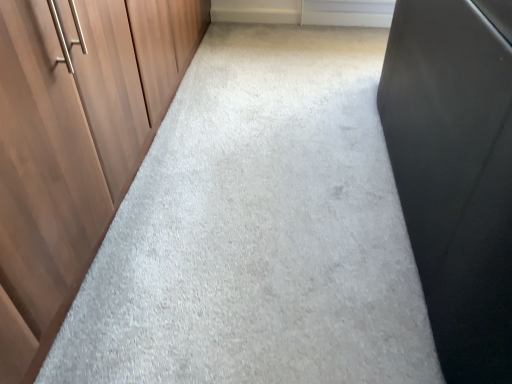
The height and width of the screenshot is (384, 512). Describe the element at coordinates (74, 144) in the screenshot. I see `wooden at left` at that location.

Locate an element on the screen. This screenshot has width=512, height=384. wooden at left is located at coordinates (74, 144).

Locate an element on the screen. The height and width of the screenshot is (384, 512). white matte window at upper center is located at coordinates (347, 12).

What do you see at coordinates (347, 12) in the screenshot? I see `white matte window at upper center` at bounding box center [347, 12].

This screenshot has height=384, width=512. Find the location of `wooden at left`. wooden at left is located at coordinates (74, 144).

Considering the relative positions of wooden at left and white matte window at upper center in the image provided, is wooden at left to the left or to the right of white matte window at upper center?

Based on their positions, wooden at left is located to the left of white matte window at upper center.

Is the position of wooden at left more distant than that of white matte window at upper center?

No, the depth of wooden at left is less than that of white matte window at upper center.

Which is nearer, [47,236] or [367,26]?

Point [47,236] is positioned closer to the camera compared to point [367,26].

From the image's perspective, which one is positioned higher, wooden at left or white matte window at upper center?

white matte window at upper center, from the image's perspective.

From a real-world perspective, who is located lower, wooden at left or white matte window at upper center?

From a 3D spatial view, white matte window at upper center is below.

Considering the relative sizes of wooden at left and white matte window at upper center in the image provided, is wooden at left wider than white matte window at upper center?

Indeed, wooden at left has a greater width compared to white matte window at upper center.

Considering the relative sizes of wooden at left and white matte window at upper center in the image provided, is wooden at left shorter than white matte window at upper center?

In fact, wooden at left may be taller than white matte window at upper center.

Consider the image. Based on their sizes in the image, would you say wooden at left is bigger or smaller than white matte window at upper center?

Considering their sizes, wooden at left takes up more space than white matte window at upper center.

Looking at this image, is wooden at left situated inside white matte window at upper center or outside?

wooden at left lies outside white matte window at upper center.

Is wooden at left beside white matte window at upper center?

No.

Is wooden at left oriented away from white matte window at upper center?

That's not correct — wooden at left is not looking away from white matte window at upper center.

Can you tell me how much wooden at left and white matte window at upper center differ in facing direction?

89.9 degrees separate the facing orientations of wooden at left and white matte window at upper center.

Find the location of a particular element. The height and width of the screenshot is (384, 512). cupboard in front of the white matte window at upper center is located at coordinates (74, 144).

Considering the relative positions of white matte window at upper center and wooden at left in the image provided, is white matte window at upper center to the right of wooden at left from the viewer's perspective?

Correct, you'll find white matte window at upper center to the right of wooden at left.

Does white matte window at upper center lie behind wooden at left?

Yes, it is.

Considering the positions of point (335, 16) and point (196, 3), is point (335, 16) closer or farther from the camera than point (196, 3)?

Point (335, 16).

Looking at this image, from the image's perspective, is white matte window at upper center located above wooden at left?

Yes.

Looking at this image, from a real-world perspective, which is physically above, white matte window at upper center or wooden at left?

From a 3D spatial view, wooden at left is above.

Which of these two, white matte window at upper center or wooden at left, is wider?

Wider between the two is wooden at left.

Which of these two, white matte window at upper center or wooden at left, stands taller?

wooden at left.

Considering the relative sizes of white matte window at upper center and wooden at left in the image provided, is white matte window at upper center smaller than wooden at left?

Correct, white matte window at upper center occupies less space than wooden at left.

Can wooden at left be found inside white matte window at upper center?

No, white matte window at upper center does not contain wooden at left.

Are white matte window at upper center and wooden at left far apart?

That's right, there is a large distance between white matte window at upper center and wooden at left.

Is white matte window at upper center turned away from wooden at left?

No, white matte window at upper center's orientation is not away from wooden at left.

Can you tell me how much white matte window at upper center and wooden at left differ in facing direction?

The angle between the facing direction of white matte window at upper center and the facing direction of wooden at left is 89.9 degrees.

Identify the location of window directly beneath the wooden at left (from a real-world perspective). (347, 12).

Locate an element on the screen. The width and height of the screenshot is (512, 384). cupboard below the white matte window at upper center (from the image's perspective) is located at coordinates (74, 144).

The width and height of the screenshot is (512, 384). Identify the location of window behind the wooden at left. (347, 12).